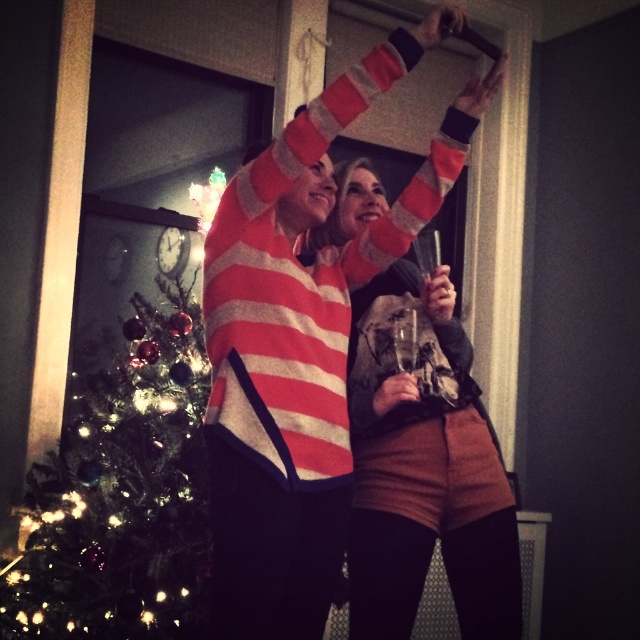
Question: Which object is closer to the camera taking this photo?

Choices:
 (A) green textured christmas tree at left
 (B) striped sweater at center

Answer: (B)

Question: Is green textured christmas tree at left smaller than striped sweater at center?

Choices:
 (A) yes
 (B) no

Answer: (B)

Question: Is the position of green textured christmas tree at left less distant than that of striped sweater at center?

Choices:
 (A) no
 (B) yes

Answer: (A)

Question: Among these points, which one is farthest from the camera?

Choices:
 (A) (120, 513)
 (B) (412, 435)

Answer: (A)

Question: Among these points, which one is farthest from the camera?

Choices:
 (A) (360, 604)
 (B) (200, 440)

Answer: (B)

Question: Is green textured christmas tree at left to the right of striped sweater at center from the viewer's perspective?

Choices:
 (A) yes
 (B) no

Answer: (B)